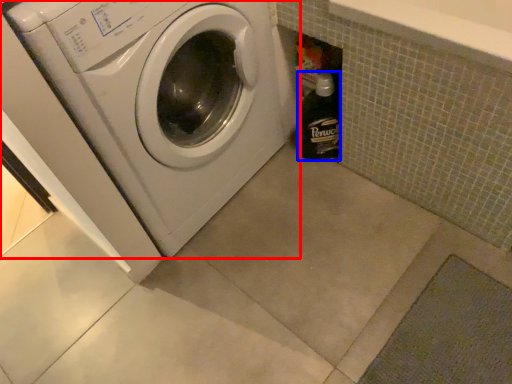
Question: Which of the following is the farthest to the observer, washing machine (highlighted by a red box) or bottle (highlighted by a blue box)?

Choices:
 (A) washing machine
 (B) bottle

Answer: (B)